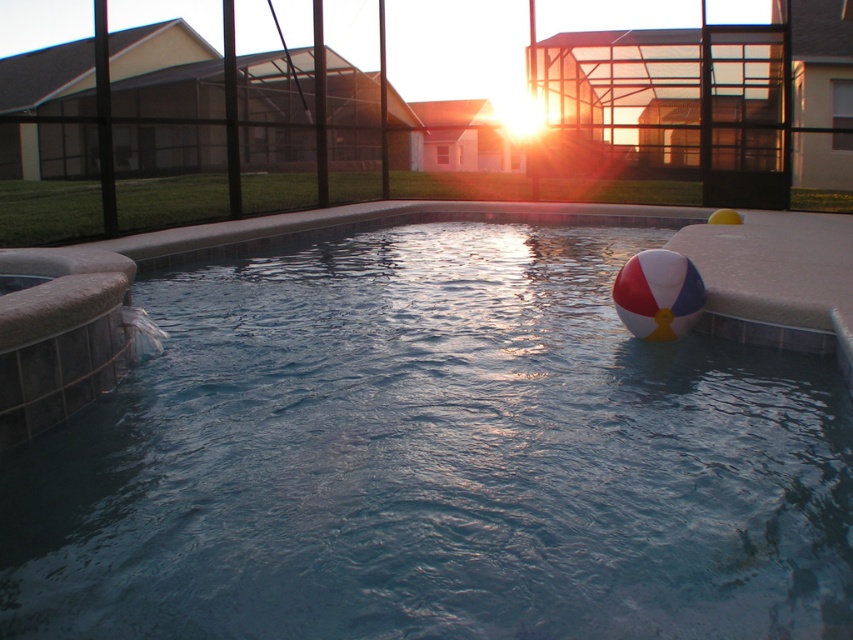
Can you confirm if blue rubber ball at upper right is positioned to the left of white and red striped beach ball at right?

Indeed, blue rubber ball at upper right is positioned on the left side of white and red striped beach ball at right.

From the picture: Does blue rubber ball at upper right have a larger size compared to white and red striped beach ball at right?

Yes.

Is point (543, 481) farther from viewer compared to point (659, 292)?

No.

Locate an element on the screen. Image resolution: width=853 pixels, height=640 pixels. blue rubber ball at upper right is located at coordinates (408, 442).